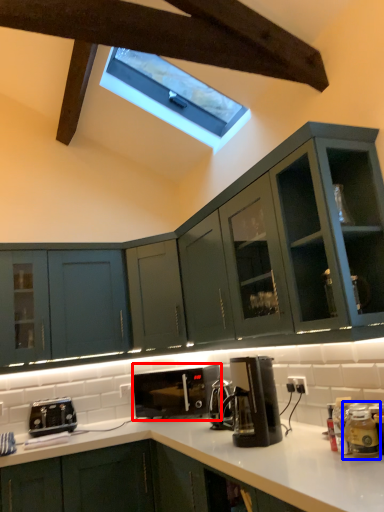
Question: Which object appears closest to the camera in this image, home appliance (highlighted by a red box) or appliance (highlighted by a blue box)?

Choices:
 (A) home appliance
 (B) appliance

Answer: (B)